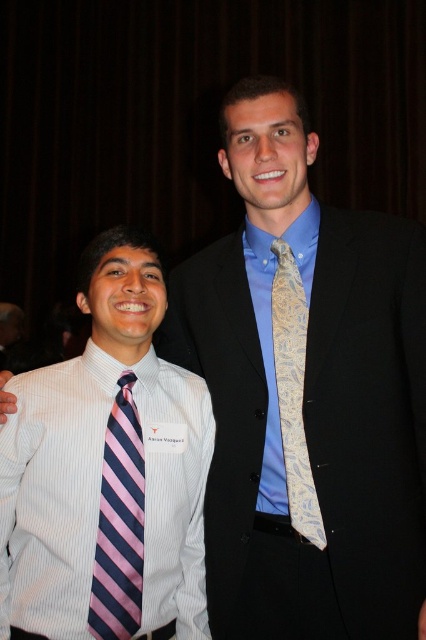
You are a photographer adjusting the lighting for a group photo. You notice the white striped dress shirt at left and the pink striped tie at left in your frame. Which of these two items is positioned more to the left?

The white striped dress shirt at left is positioned more to the left than the pink striped tie at left because the shirt is on the left side of the tie.

You are a photographer adjusting the camera focus. You need to ensure both the pink striped tie at left and the light blue paisley tie at center are in focus. Which tie should you focus on first to ensure the other is also in focus?

You should focus on the pink striped tie at left first because it is closer to the camera than the light blue paisley tie at center, ensuring both are in focus.

You are standing at the camera position and want to reach the point marked as point [11,456]. If you take a step forward of 4 feet, will you reach that point?

The point [11,456] is 3.92 feet away from the camera. Taking a step forward of 4 feet would overshoot the point by approximately 0.08 feet, so you would pass the point slightly.